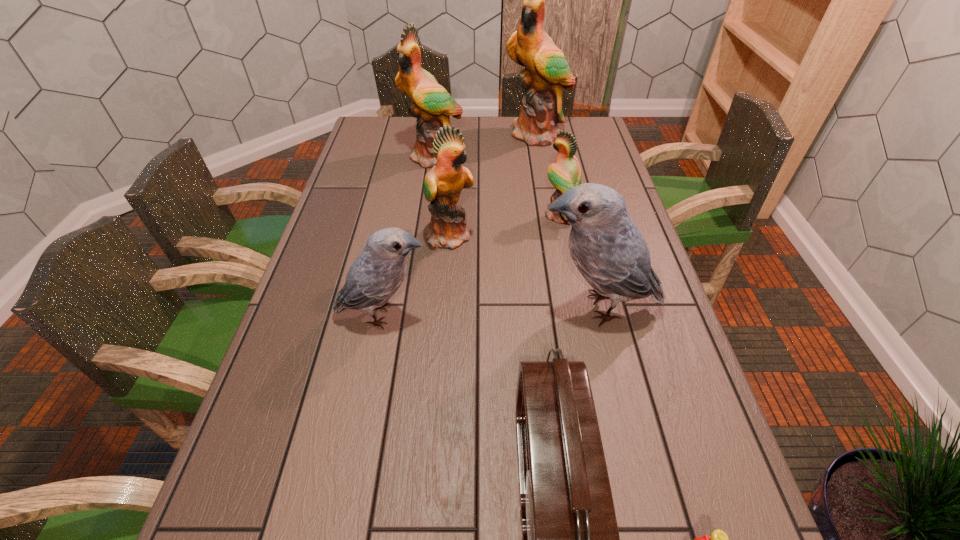
This screenshot has width=960, height=540. I want to click on vacant position at the left edge of the desktop, so click(x=353, y=158).

This screenshot has height=540, width=960. Identify the location of vacant region at the right edge. (644, 476).

Where is `free space at the far left corner of the desktop`? free space at the far left corner of the desktop is located at coordinates (376, 120).

In the image, there is a desktop. Where is `vacant space at the far right corner`? Image resolution: width=960 pixels, height=540 pixels. vacant space at the far right corner is located at coordinates (588, 125).

The width and height of the screenshot is (960, 540). In order to click on unoccupied area between the biggest green parrot and the third biggest green parrot in this screenshot , I will do `click(494, 185)`.

Locate an element on the screen. Image resolution: width=960 pixels, height=540 pixels. vacant space that is in between the bigger gray parrot and the second biggest green parrot is located at coordinates (516, 233).

Locate an element on the screen. vacant space in between the tallest parrot and the third biggest green parrot is located at coordinates (494, 185).

The image size is (960, 540). I want to click on free spot between the right gray parrot and the left gray parrot, so click(x=491, y=312).

The height and width of the screenshot is (540, 960). What are the coordinates of `blank region between the left gray parrot and the second smallest green parrot` in the screenshot? It's located at (417, 275).

Locate an element on the screen. free space between the right gray parrot and the second biggest green parrot is located at coordinates (516, 233).